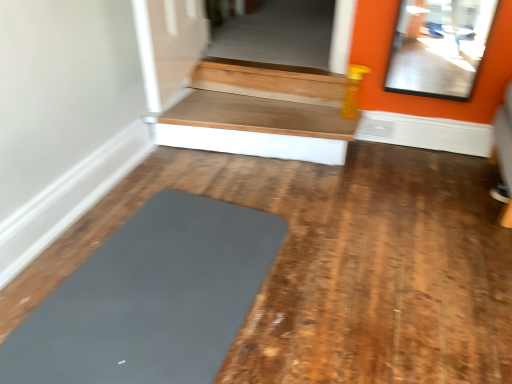
At what (x,y) coordinates should I click in order to perform the action: click on vacant area that is in front of wooden at upper right. Please return your answer as a coordinate pair (x, y). Looking at the image, I should click on (246, 215).